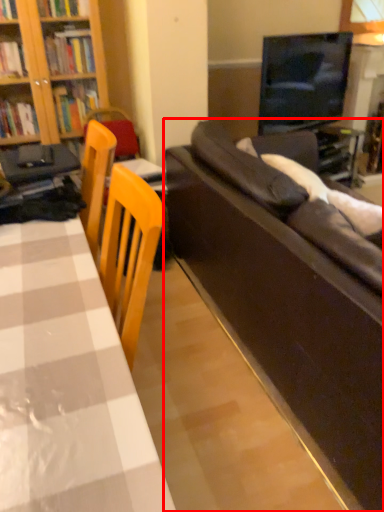
Question: From the image, what is the correct spatial relationship of studio couch (annotated by the red box) in relation to table?

Choices:
 (A) right
 (B) left

Answer: (A)